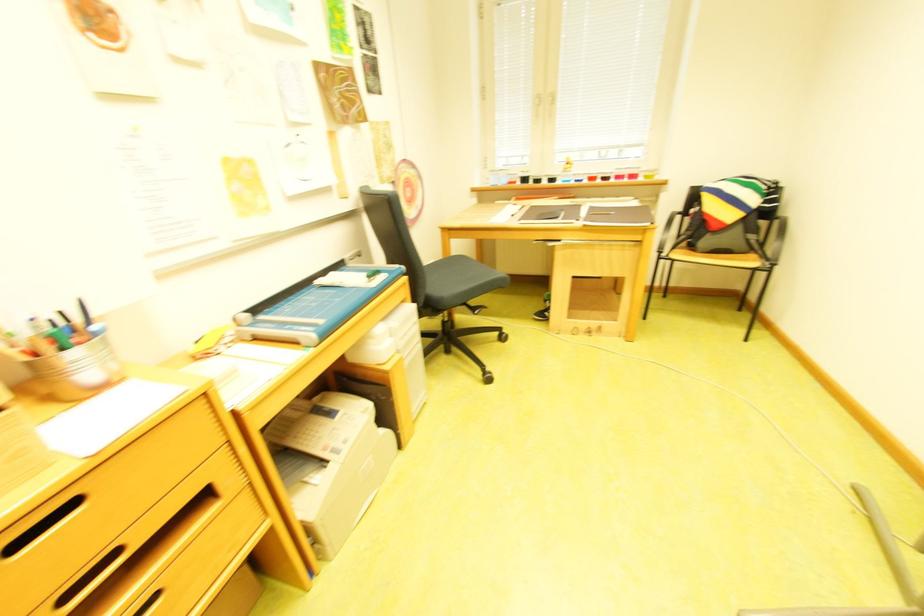
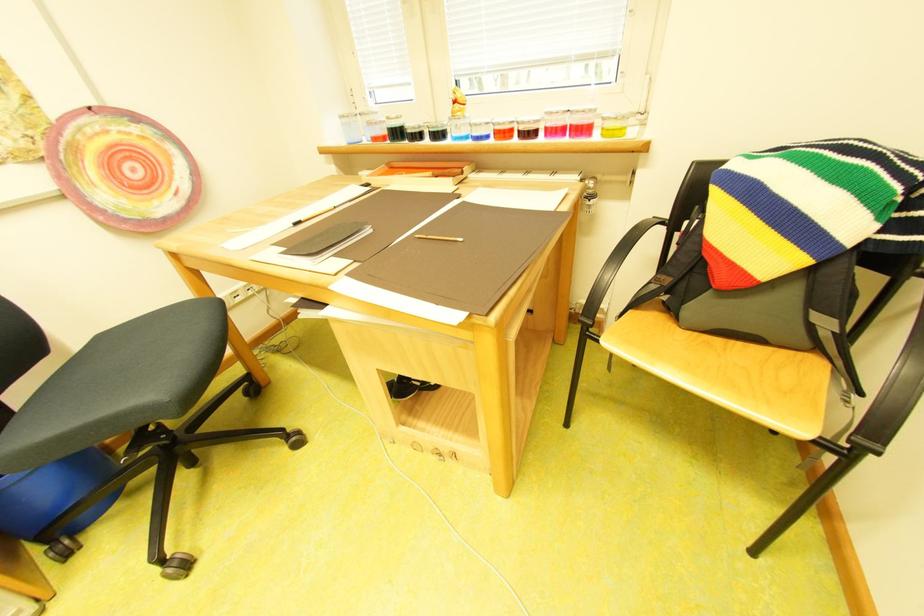
Where in the second image is the point corresponding to the point at 764,257 from the first image?

(829, 367)